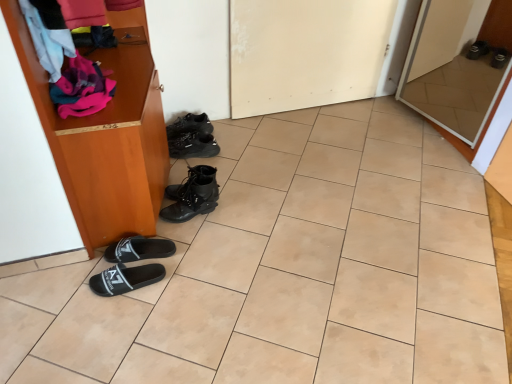
Where is `vacant space that's between black leather sneakers at center, positioned as the 5th footwear in bottom-to-top order, and black leather sneakers at center, acting as the 4th footwear starting from the front`? This screenshot has width=512, height=384. vacant space that's between black leather sneakers at center, positioned as the 5th footwear in bottom-to-top order, and black leather sneakers at center, acting as the 4th footwear starting from the front is located at coordinates (195, 140).